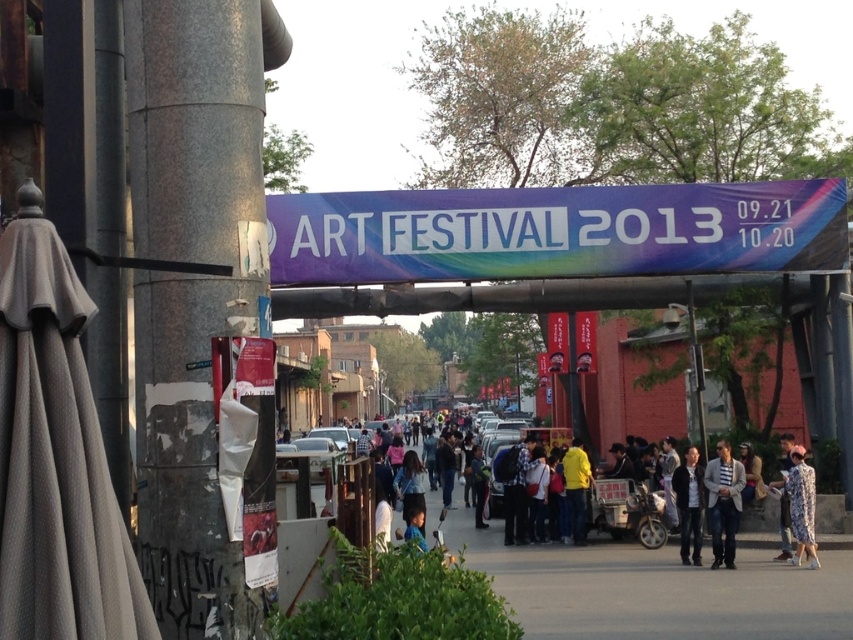
Between striped cotton shirt at center and dark gray jacket at center, which one has more height?

Standing taller between the two is striped cotton shirt at center.

Does striped cotton shirt at center have a greater width compared to dark gray jacket at center?

Correct, the width of striped cotton shirt at center exceeds that of dark gray jacket at center.

Does point (730, 525) come closer to viewer compared to point (700, 474)?

That is True.

Where is `striped cotton shirt at center`? This screenshot has height=640, width=853. striped cotton shirt at center is located at coordinates (723, 502).

Does white fabric banner at center appear on the right side of floral dress at center?

No, white fabric banner at center is not to the right of floral dress at center.

Describe the element at coordinates (555, 230) in the screenshot. I see `white fabric banner at center` at that location.

Identify the location of white fabric banner at center. (555, 230).

This screenshot has width=853, height=640. Find the location of `floral dress at center`. floral dress at center is located at coordinates (801, 506).

Between floral dress at center and yellow matte jacket at center, which one has less height?

yellow matte jacket at center is shorter.

Who is more forward, (804, 528) or (570, 467)?

Positioned in front is point (804, 528).

I want to click on floral dress at center, so click(801, 506).